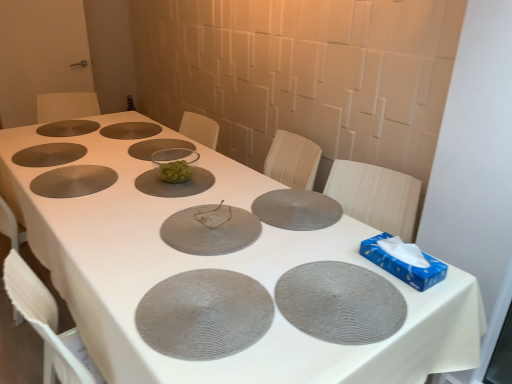
You are a GUI agent. You are given a task and a screenshot of the screen. Output one action in this format:
    pyautogui.click(x=<x>, y=<y>)
    Task: Click on the vacant space that's between gray textured placemat at center, positioned as the 10th glass plate in back-to-front order, and matte gray glass plate at center, placed as the third glass plate when sorted from front to back
    The image size is (512, 384).
    Given the screenshot: What is the action you would take?
    pyautogui.click(x=194, y=254)